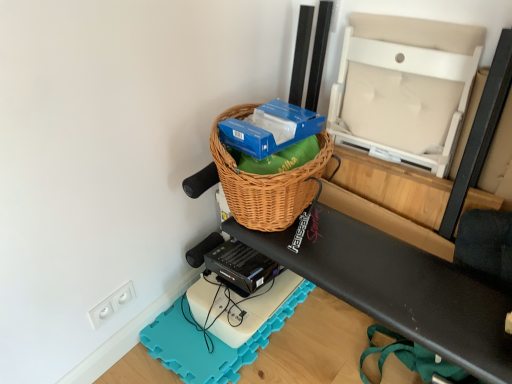
Question: From the image's perspective, is white foam yoga mat at lower center below beige fabric chair at upper right, the 1th wide when ordered from top to bottom?

Choices:
 (A) no
 (B) yes

Answer: (B)

Question: Is white foam yoga mat at lower center to the left of beige fabric chair at upper right, which appears as the 2th wide when ordered from the bottom, from the viewer's perspective?

Choices:
 (A) yes
 (B) no

Answer: (A)

Question: From a real-world perspective, is white foam yoga mat at lower center positioned over beige fabric chair at upper right, which appears as the 2th wide when ordered from the bottom, based on gravity?

Choices:
 (A) yes
 (B) no

Answer: (B)

Question: Can beige fabric chair at upper right, the 1th wide when ordered from top to bottom, be found inside white foam yoga mat at lower center?

Choices:
 (A) no
 (B) yes

Answer: (A)

Question: Could you tell me if white foam yoga mat at lower center is turned towards beige fabric chair at upper right, which appears as the 2th wide when ordered from the bottom?

Choices:
 (A) yes
 (B) no

Answer: (B)

Question: Is white foam yoga mat at lower center turned away from beige fabric chair at upper right, which appears as the 2th wide when ordered from the bottom?

Choices:
 (A) yes
 (B) no

Answer: (B)

Question: Is woven brown basket at center, which is counted as the 1th wide, starting from the bottom, located outside beige fabric chair at upper right, which appears as the 2th wide when ordered from the bottom?

Choices:
 (A) no
 (B) yes

Answer: (B)

Question: Is woven brown basket at center, which is counted as the 1th wide, starting from the bottom, in front of beige fabric chair at upper right, which appears as the 2th wide when ordered from the bottom?

Choices:
 (A) yes
 (B) no

Answer: (A)

Question: Is woven brown basket at center, arranged as the 2th wide when viewed from the top, next to beige fabric chair at upper right, which appears as the 2th wide when ordered from the bottom?

Choices:
 (A) yes
 (B) no

Answer: (B)

Question: From a real-world perspective, is woven brown basket at center, arranged as the 2th wide when viewed from the top, beneath beige fabric chair at upper right, which appears as the 2th wide when ordered from the bottom?

Choices:
 (A) no
 (B) yes

Answer: (B)

Question: Is woven brown basket at center, which is counted as the 1th wide, starting from the bottom, at the left side of beige fabric chair at upper right, which appears as the 2th wide when ordered from the bottom?

Choices:
 (A) no
 (B) yes

Answer: (B)

Question: Does woven brown basket at center, arranged as the 2th wide when viewed from the top, have a lesser height compared to beige fabric chair at upper right, the 1th wide when ordered from top to bottom?

Choices:
 (A) no
 (B) yes

Answer: (B)

Question: Does woven brown picnic basket at upper center have a greater width compared to white plastic electric outlet at lower left?

Choices:
 (A) no
 (B) yes

Answer: (B)